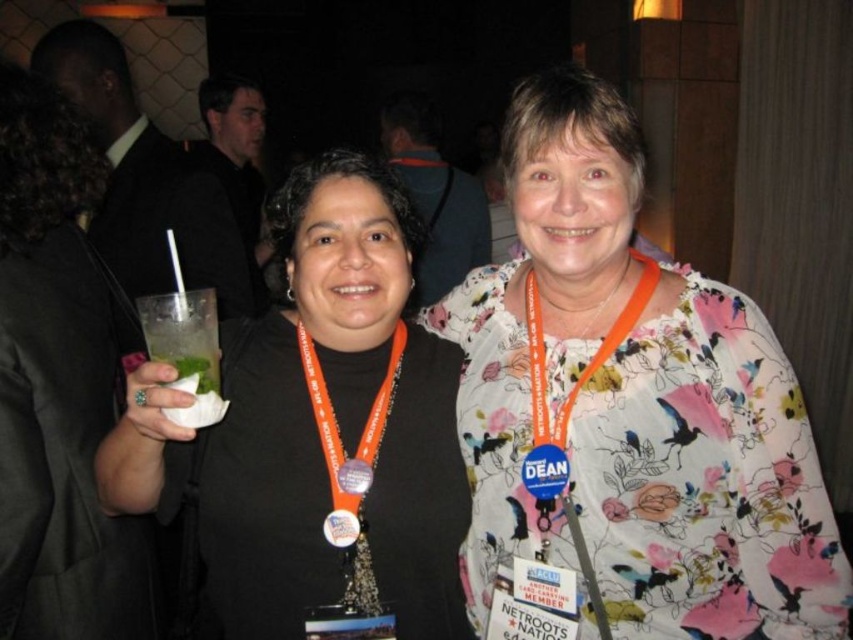
Based on the photo, does matte black shirt at center appear under metallic silver badge at center?

Incorrect, matte black shirt at center is not positioned below metallic silver badge at center.

Which is behind, point (358, 584) or point (337, 547)?

The point (358, 584) is behind.

Find the location of a particular element. matte black shirt at center is located at coordinates (318, 426).

Who is lower down, blue fabric badge at center or orange plastic badge at center?

orange plastic badge at center is lower down.

Does blue fabric badge at center lie in front of orange plastic badge at center?

Yes.

Who is more forward, [527,477] or [357,490]?

Point [527,477] is in front.

Find the location of a particular element. This screenshot has width=853, height=640. blue fabric badge at center is located at coordinates (544, 472).

Is matte black shirt at center further to the viewer compared to blue fabric badge at center?

No, it is not.

Can you confirm if matte black shirt at center is positioned above blue fabric badge at center?

Yes.

Identify the location of matte black shirt at center. The width and height of the screenshot is (853, 640). (318, 426).